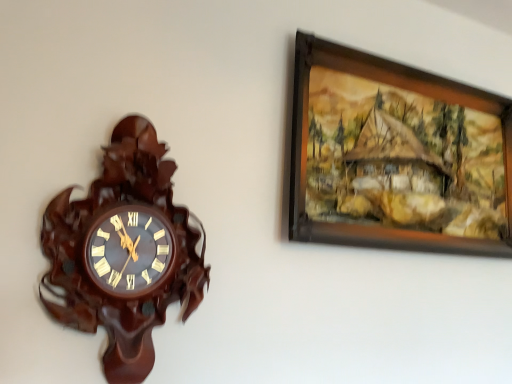
Question: In the image, is mahogany wood wall clock at left positioned in front of or behind brown wooden picture frame at upper right?

Choices:
 (A) front
 (B) behind

Answer: (A)

Question: Does point (153, 279) appear closer or farther from the camera than point (400, 119)?

Choices:
 (A) closer
 (B) farther

Answer: (A)

Question: In terms of height, does mahogany wood wall clock at left look taller or shorter compared to brown wooden picture frame at upper right?

Choices:
 (A) tall
 (B) short

Answer: (A)

Question: Considering the positions of brown wooden picture frame at upper right and mahogany wood wall clock at left in the image, is brown wooden picture frame at upper right wider or thinner than mahogany wood wall clock at left?

Choices:
 (A) thin
 (B) wide

Answer: (A)

Question: From a real-world perspective, is brown wooden picture frame at upper right above or below mahogany wood wall clock at left?

Choices:
 (A) above
 (B) below

Answer: (A)

Question: In terms of height, does brown wooden picture frame at upper right look taller or shorter compared to mahogany wood wall clock at left?

Choices:
 (A) tall
 (B) short

Answer: (B)

Question: From the image's perspective, is brown wooden picture frame at upper right above or below mahogany wood wall clock at left?

Choices:
 (A) below
 (B) above

Answer: (B)